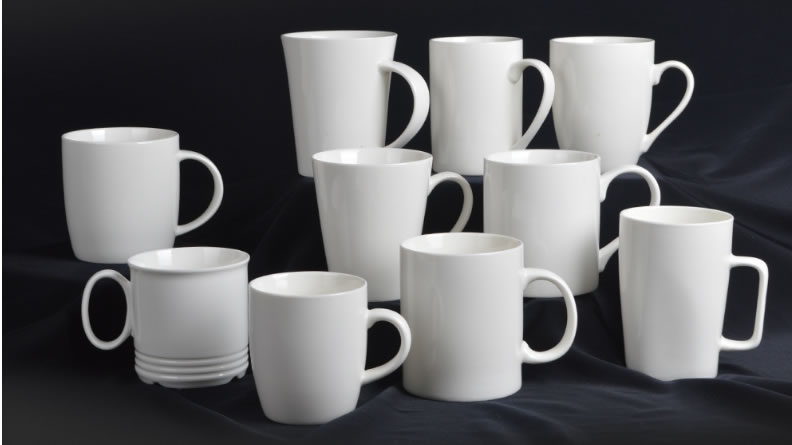
Where is `white mugs`? white mugs is located at coordinates (128, 178), (174, 282), (345, 342), (433, 305), (370, 178), (325, 67), (461, 64), (626, 82), (547, 188), (661, 260).